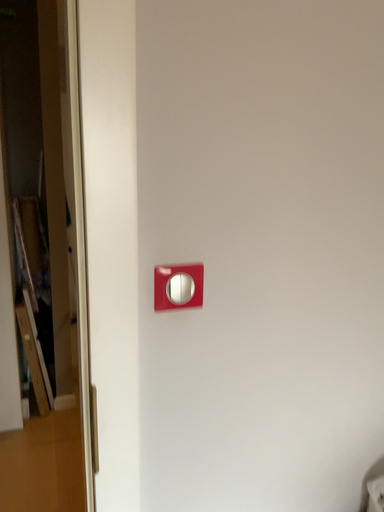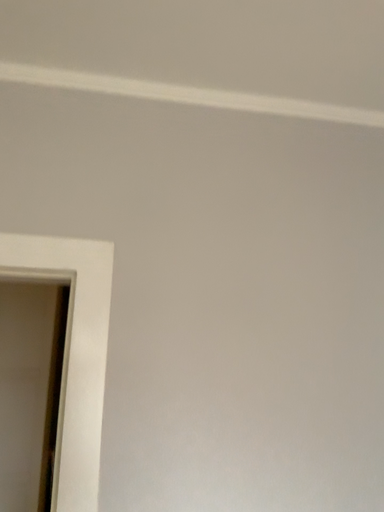
Question: How did the camera likely rotate when shooting the video?

Choices:
 (A) rotated upward
 (B) rotated downward

Answer: (A)